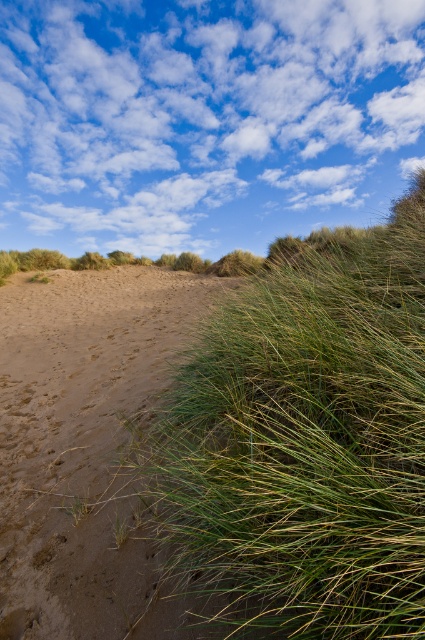
Which is below, green grassy at center or brown sandy at left?

green grassy at center

Can you confirm if green grassy at center is bigger than brown sandy at left?

No.

Describe the element at coordinates (306, 440) in the screenshot. I see `green grassy at center` at that location.

Find the location of a particular element. green grassy at center is located at coordinates (306, 440).